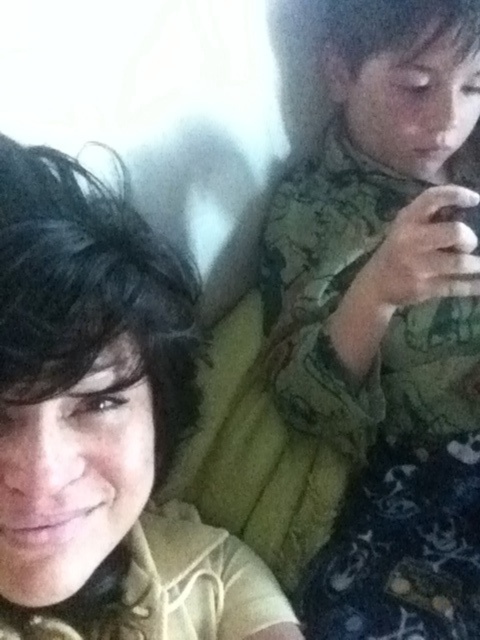
You are a photographer trying to adjust the lighting in the scene. You notice the camouflage fabric shirt at upper right and the yellow fabric pillow at center. Which object is positioned higher in the frame?

The camouflage fabric shirt at upper right is located above the yellow fabric pillow at center, so it is positioned higher in the frame.

You are trying to decide which shirt to wear for a casual day out. Both the camouflage fabric shirt at upper right and the matte yellow shirt at center are options. Based on the image, which shirt is taller?

The camouflage fabric shirt at upper right is taller than the matte yellow shirt at center according to the image description.

You are trying to decide which item to take with you for a quick trip. You can only choose between the matte yellow shirt at center and the yellow fabric pillow at center. Based on their sizes, which one is more practical to carry?

The matte yellow shirt at center is thinner than the yellow fabric pillow at center, so the matte yellow shirt at center is more practical to carry as it takes up less space.